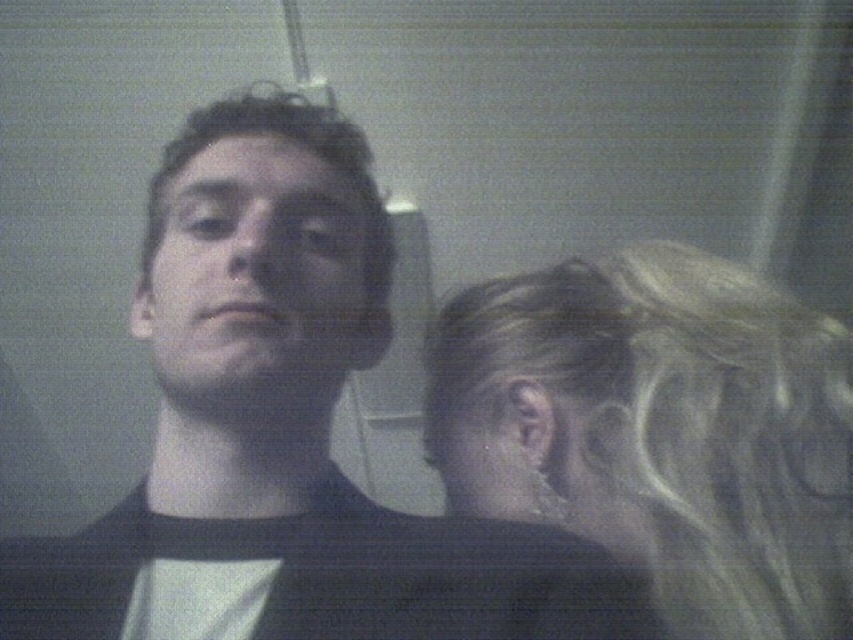
Is the position of black matte shirt at center more distant than that of matte black face at center?

No.

Is black matte shirt at center above matte black face at center?

Yes.

Is point (271, 381) positioned in front of point (364, 340)?

Yes, it is.

Where is `black matte shirt at center`? black matte shirt at center is located at coordinates (285, 432).

Does black matte shirt at center appear on the right side of blonde hair at right?

Incorrect, black matte shirt at center is not on the right side of blonde hair at right.

Which is in front, point (322, 392) or point (605, 276)?

Point (322, 392) is more forward.

Who is more distant from viewer, (x=351, y=358) or (x=733, y=448)?

Point (x=351, y=358)

Locate an element on the screen. The height and width of the screenshot is (640, 853). black matte shirt at center is located at coordinates (285, 432).

From the picture: Is blonde hair at right thinner than matte black face at center?

No, blonde hair at right is not thinner than matte black face at center.

Does blonde hair at right have a smaller size compared to matte black face at center?

Incorrect, blonde hair at right is not smaller in size than matte black face at center.

Where is `blonde hair at right`? blonde hair at right is located at coordinates (660, 432).